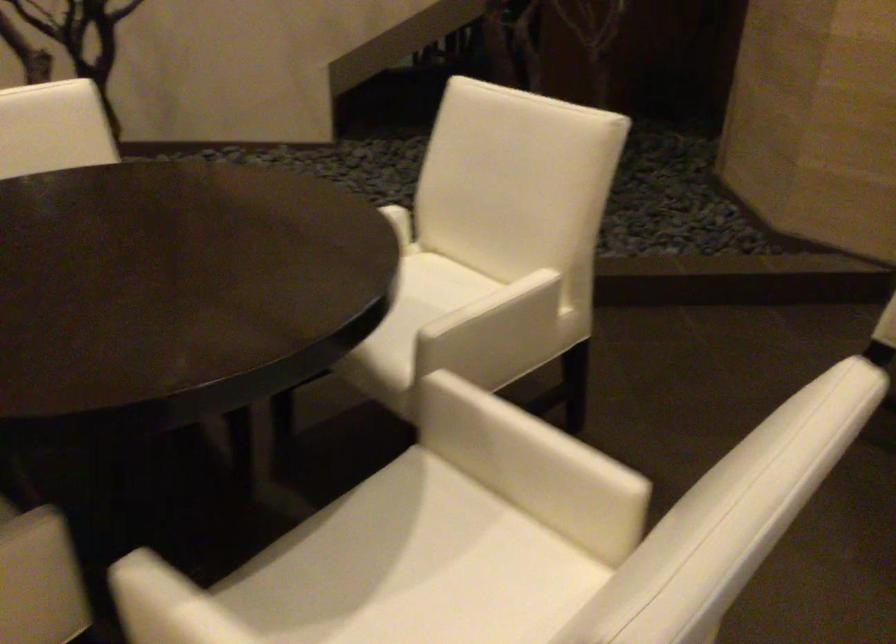
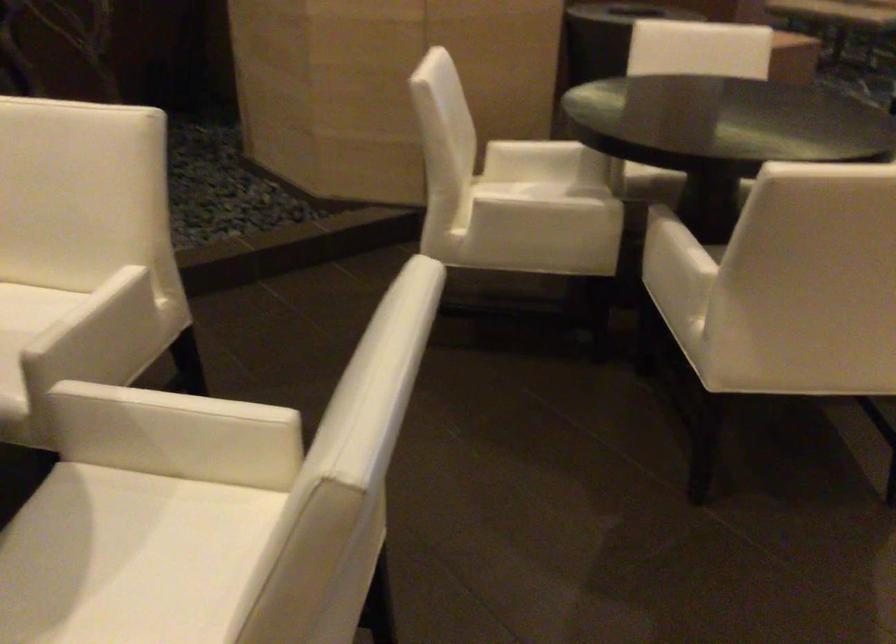
Locate, in the second image, the point that corresponds to (x=426, y=565) in the first image.

(122, 558)